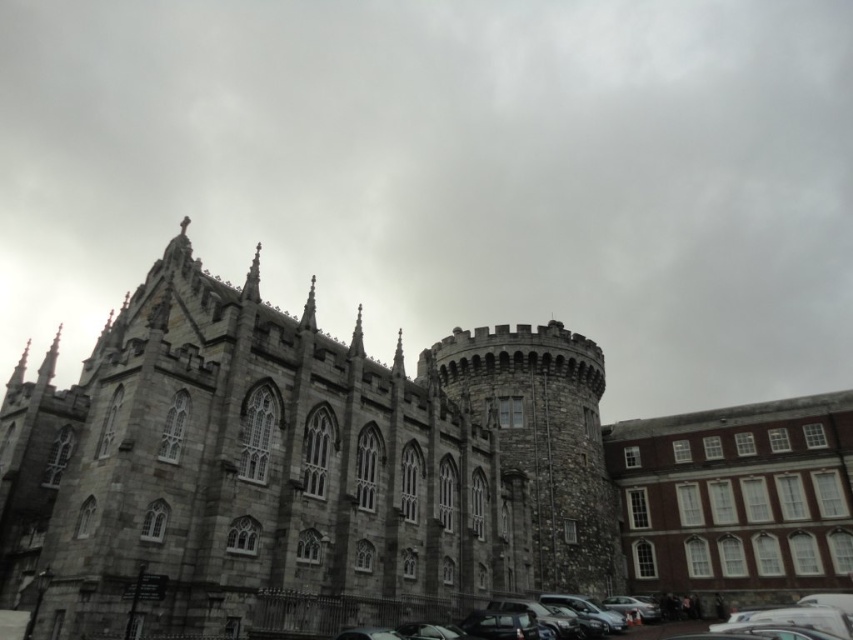
You are standing in front of a historic building and want to locate a specific point marked at coordinates (294, 465). Based on the scene description, where would this point be located?

The point at coordinates (294, 465) is on the gray stone castle at center.

You are standing at the entrance of the gray stone castle at center. A friend is standing at coordinates point A, which is at position 0.6, 0.3. Can you see your friend from your current position?

The gray stone castle at center is located at point (x=294, y=465). Since your friend is at point A, which is (x=254, y=384), they are relatively close but slightly to the left and below your position. Depending on the layout of the castle grounds, there might be obstructions like walls or structures between you and your friend. However, based solely on the coordinate positions, there is a possibility of seeing them if there are no physical barriers.